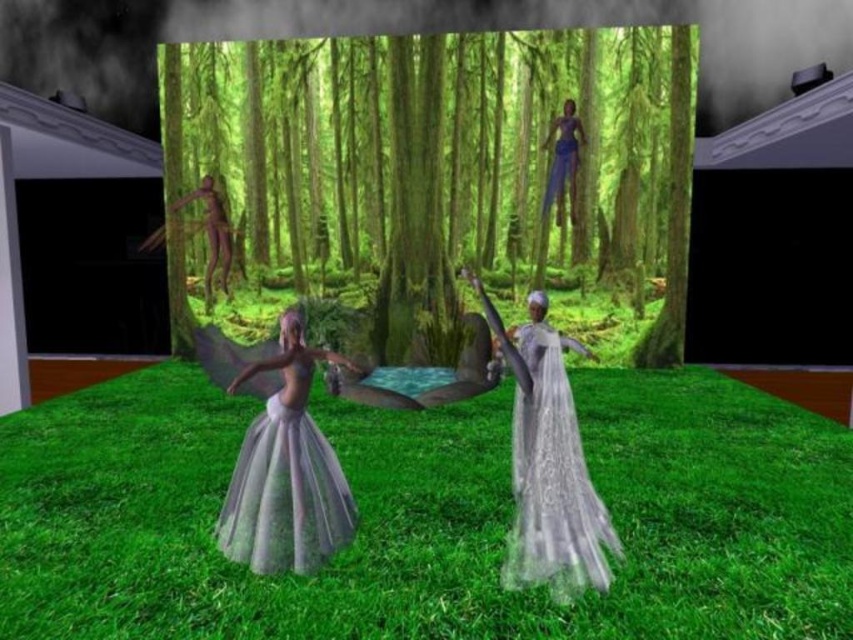
Between green grass at center and translucent white dress at center, which one has less height?

green grass at center

Which is above, green grass at center or translucent white dress at center?

translucent white dress at center is higher up.

Which is behind, point (793, 624) or point (561, 442)?

The point (561, 442) is behind.

The width and height of the screenshot is (853, 640). What are the coordinates of `green grass at center` in the screenshot? It's located at (427, 516).

Who is taller, green grass at center or green matte tree at center?

Standing taller between the two is green matte tree at center.

Is point (468, 548) farther from camera compared to point (677, 285)?

No.

Which is behind, point (364, 442) or point (460, 204)?

Positioned behind is point (460, 204).

Locate an element on the screen. This screenshot has height=640, width=853. green grass at center is located at coordinates (427, 516).

Is point (334, 452) less distant than point (569, 552)?

That is False.

Who is positioned more to the right, translucent silver dress at center or translucent white dress at center?

From the viewer's perspective, translucent white dress at center appears more on the right side.

Where is `translucent silver dress at center`? translucent silver dress at center is located at coordinates (286, 470).